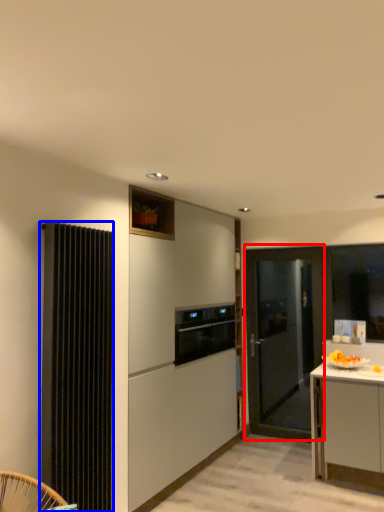
Question: Among these objects, which one is nearest to the camera, door (highlighted by a red box) or radiator (highlighted by a blue box)?

Choices:
 (A) door
 (B) radiator

Answer: (B)